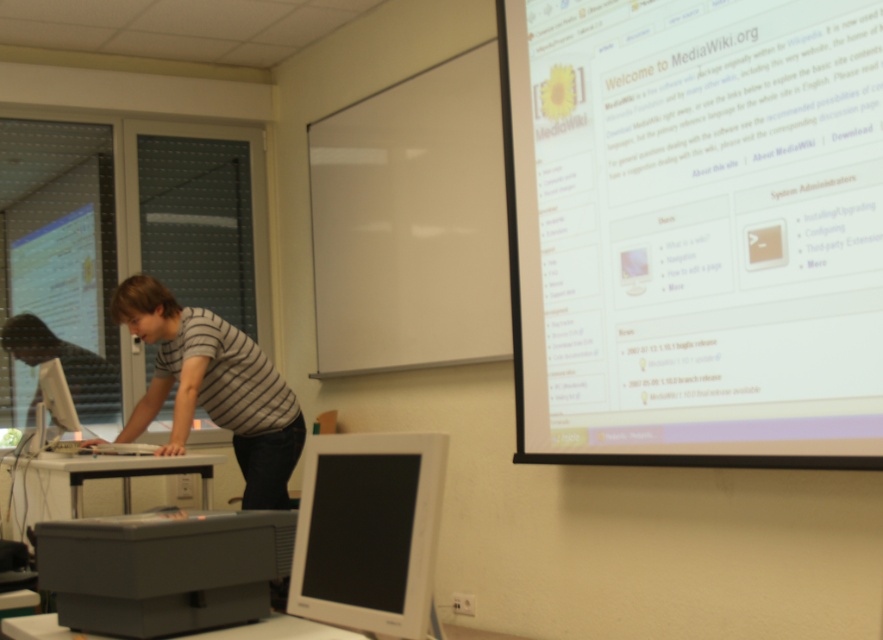
From the picture: You are a student sitting at the back of the classroom. You need to hand in a paper to the presenter who is at the desk. The desk has a matte gray printer at lower left and a striped fabric shirt at center. Which object is closer to you when you approach the desk?

The striped fabric shirt at center is closer to you because the matte gray printer at lower left is below it, meaning the shirt is positioned higher and thus nearer when approaching the desk from the back.

You are setting up a classroom for a presentation. You have a matte gray printer at lower left and a matte gray monitor at left. Which object is shorter?

The matte gray printer at lower left is shorter than the matte gray monitor at left.